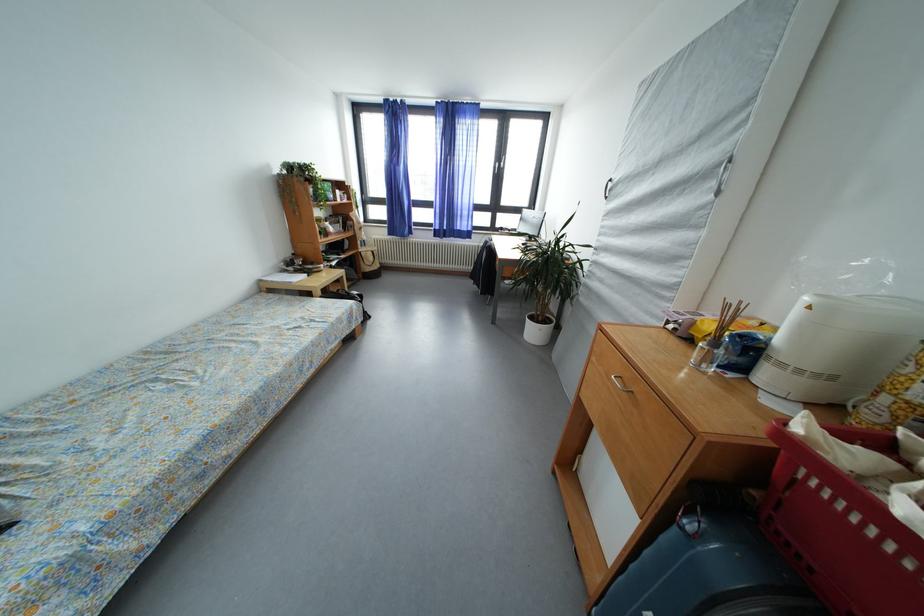
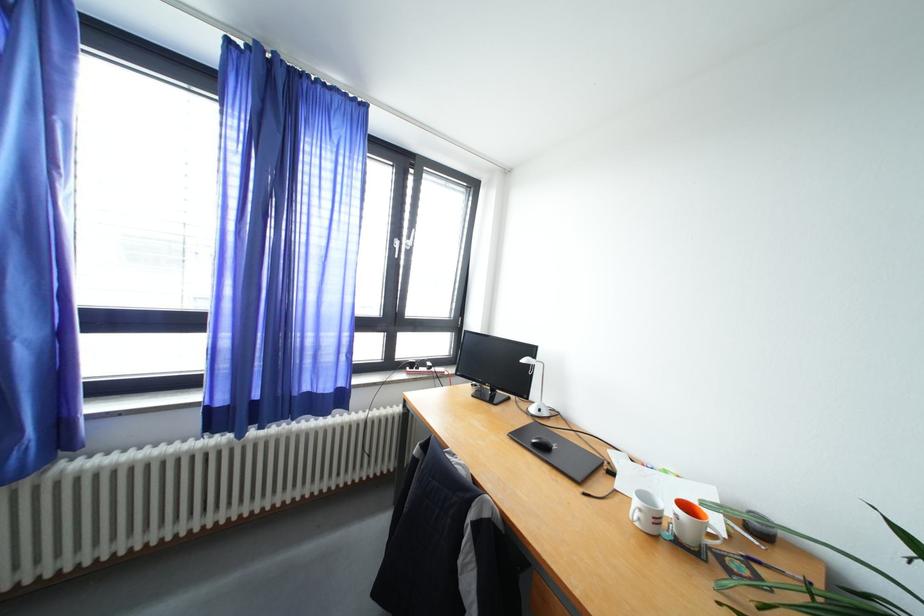
The point at (507, 233) is marked in the first image. Where is the corresponding point in the second image?

(419, 370)